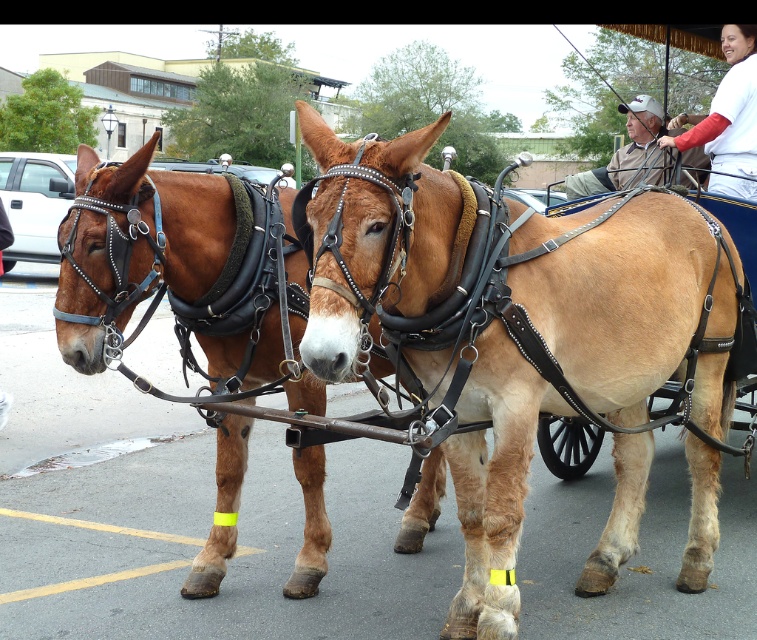
In the scene shown: Where is the light brown leather harness at center located in the image?

The light brown leather harness at center is located at point (628,300).

Looking at this image, you are a photographer trying to capture a clear shot of the white cotton shirt at upper right without the brown leather harness at left blocking it. Based on their heights, can you suggest a shooting angle that would allow the shirt to be visible above the harness?

The brown leather harness at left is taller than the white cotton shirt at upper right. To ensure the shirt is visible above the harness, you should position the camera lower to the ground so the shirt can be seen over the top of the harness.